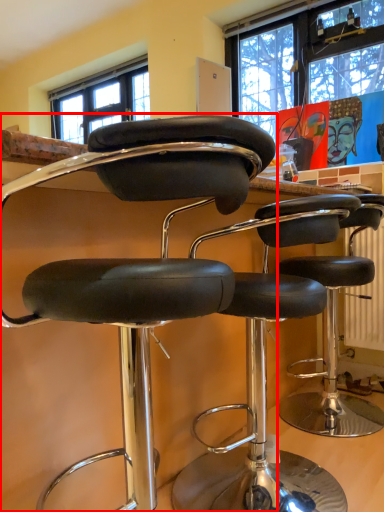
Question: Where is chair (annotated by the red box) located in relation to chair in the image?

Choices:
 (A) right
 (B) left

Answer: (B)